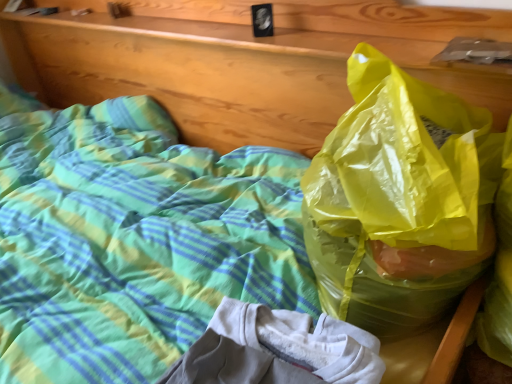
Where is `yellow translucent plastic bag at upper right`? This screenshot has width=512, height=384. yellow translucent plastic bag at upper right is located at coordinates (400, 200).

What do you see at coordinates (400, 200) in the screenshot? This screenshot has width=512, height=384. I see `yellow translucent plastic bag at upper right` at bounding box center [400, 200].

Identify the location of yellow translucent plastic bag at upper right. (400, 200).